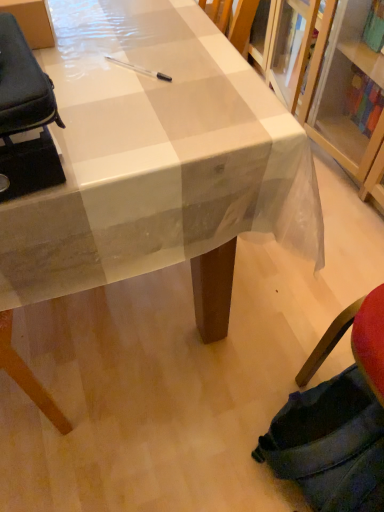
Find the location of `white checkered tablecloth at center`. white checkered tablecloth at center is located at coordinates (158, 162).

This screenshot has width=384, height=512. What do you see at coordinates (158, 162) in the screenshot? I see `white checkered tablecloth at center` at bounding box center [158, 162].

I want to click on white checkered tablecloth at center, so click(x=158, y=162).